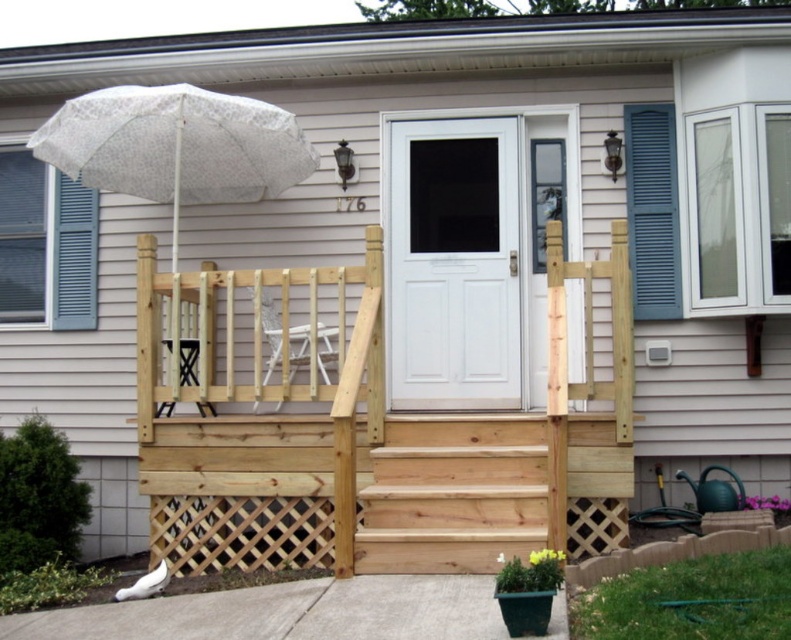
You are a delivery person trying to deliver a package to the house. The white painted wood door at center has a delivery slot. Can you fit a 1.2 meter long package through the slot if the slot is as tall as the white lace umbrella at upper left?

The white painted wood door at center is taller than the white lace umbrella at upper left. Since the slot is as tall as the umbrella, the package may not fit vertically if it exceeds the umbrella height. However, the question mentions the package length, not height. The slot height is determined by the umbrella, so if the package length can be oriented horizontally within the slot dimensions, it might fit. But without knowing the slot width, it is unclear. The answer should focus on the height comparison.

You are a delivery person trying to reach the front door of the house. You see the natural wood porch at center and the natural wood stairs at center. Which one should you step onto first to reach the door?

You should step onto the natural wood stairs at center first because the natural wood porch at center is positioned over them, meaning the stairs are below and lead up to the porch.

You are standing at the entrance of the house and want to place a small potted plant. You have two spots marked by coordinates point [483,244] and point [93,113]. Which coordinate is closer to you, so you can easily reach it without moving further into the deck?

Point [93,113] is closer to you because it is nearer than point [483,244], which is further away from the entrance.